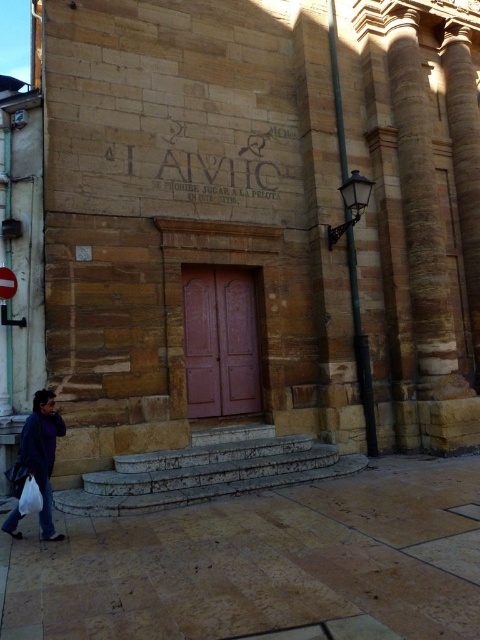
Looking at this image, you are a tourist visiting the stone building and want to take a photo of both the stone engraving at center and the metallic street sign at lower left. Which object should you focus on first to ensure both are in frame without moving the camera?

You should focus on the stone engraving at center first because it is taller than the metallic street sign at lower left, so it will require a wider angle to capture both in the frame.

You are a tourist visiting the historical building and notice two items at the lower left corner of the image. Which one is bigger between the denim jacket at lower left and the metallic street sign at lower left?

The denim jacket at lower left is larger in size than the metallic street sign at lower left.

You are standing in front of the historical building and want to find the exact location of the point marked as point (263, 563). Based on the scene description, where would you look to find this point?

The point (263, 563) is located on the brown stone pavement at lower center of the image.